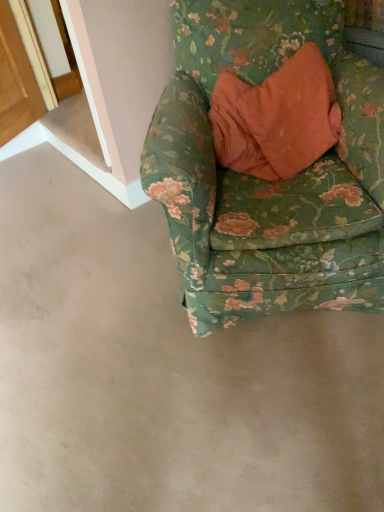
What do you see at coordinates (265, 181) in the screenshot?
I see `floral fabric chair at upper right` at bounding box center [265, 181].

The height and width of the screenshot is (512, 384). I want to click on floral fabric chair at upper right, so click(x=265, y=181).

This screenshot has width=384, height=512. Identify the location of gray concrete at lower center. (164, 372).

What do you see at coordinates (164, 372) in the screenshot?
I see `gray concrete at lower center` at bounding box center [164, 372].

Find the location of a particular element. floral fabric chair at upper right is located at coordinates (265, 181).

Which object is positioned more to the right, floral fabric chair at upper right or gray concrete at lower center?

floral fabric chair at upper right is more to the right.

Considering their positions, is floral fabric chair at upper right located in front of or behind gray concrete at lower center?

Clearly, floral fabric chair at upper right is behind gray concrete at lower center.

Considering the positions of point (157, 160) and point (165, 391), is point (157, 160) closer or farther from the camera than point (165, 391)?

Clearly, point (157, 160) is closer to the camera than point (165, 391).

From the image's perspective, who appears lower, floral fabric chair at upper right or gray concrete at lower center?

gray concrete at lower center appears lower in the image.

From a real-world perspective, is floral fabric chair at upper right located higher than gray concrete at lower center?

Yes, from a real-world perspective, floral fabric chair at upper right is above gray concrete at lower center.

Which of these two, floral fabric chair at upper right or gray concrete at lower center, is thinner?

floral fabric chair at upper right.

Between floral fabric chair at upper right and gray concrete at lower center, which one has less height?

gray concrete at lower center is shorter.

Between floral fabric chair at upper right and gray concrete at lower center, which one has larger size?

floral fabric chair at upper right.

Choose the correct answer: Is floral fabric chair at upper right inside gray concrete at lower center or outside it?

floral fabric chair at upper right is spatially situated outside gray concrete at lower center.

Is floral fabric chair at upper right with gray concrete at lower center?

No.

Is floral fabric chair at upper right aimed at gray concrete at lower center?

No, floral fabric chair at upper right is not oriented towards gray concrete at lower center.

How many degrees apart are the facing directions of floral fabric chair at upper right and gray concrete at lower center?

The facing directions of floral fabric chair at upper right and gray concrete at lower center are 126 degrees apart.

How much distance is there between floral fabric chair at upper right and gray concrete at lower center?

The distance of floral fabric chair at upper right from gray concrete at lower center is 18.42 inches.

You are a GUI agent. You are given a task and a screenshot of the screen. Output one action in this format:
    pyautogui.click(x=<x>, y=<y>)
    Task: Click on the chair located above the gray concrete at lower center (from a real-world perspective)
    
    Given the screenshot: What is the action you would take?
    pyautogui.click(x=265, y=181)

Is gray concrete at lower center at the right side of floral fabric chair at upper right?

No, gray concrete at lower center is not to the right of floral fabric chair at upper right.

In the image, is gray concrete at lower center positioned in front of or behind floral fabric chair at upper right?

In the image, gray concrete at lower center appears in front of floral fabric chair at upper right.

Which point is more distant from viewer, [165,456] or [268,270]?

The point [268,270] is farther from the camera.

From the image's perspective, is gray concrete at lower center above or below floral fabric chair at upper right?

Clearly, from the image's perspective, gray concrete at lower center is below floral fabric chair at upper right.

From a real-world perspective, does gray concrete at lower center stand above floral fabric chair at upper right?

No, from a real-world perspective, gray concrete at lower center is not above floral fabric chair at upper right.

Is gray concrete at lower center wider than floral fabric chair at upper right?

Yes, gray concrete at lower center is wider than floral fabric chair at upper right.

Considering the sizes of objects gray concrete at lower center and floral fabric chair at upper right in the image provided, who is taller, gray concrete at lower center or floral fabric chair at upper right?

With more height is floral fabric chair at upper right.

Can you confirm if gray concrete at lower center is bigger than floral fabric chair at upper right?

Incorrect, gray concrete at lower center is not larger than floral fabric chair at upper right.

Is gray concrete at lower center not inside floral fabric chair at upper right?

Yes, gray concrete at lower center is located beyond the bounds of floral fabric chair at upper right.

Is gray concrete at lower center beside floral fabric chair at upper right?

No, gray concrete at lower center is not touching floral fabric chair at upper right.

Is gray concrete at lower center positioned with its back to floral fabric chair at upper right?

gray concrete at lower center does not have its back to floral fabric chair at upper right.

This screenshot has height=512, width=384. Find the location of `concrete below the floral fabric chair at upper right (from the image's perspective)`. concrete below the floral fabric chair at upper right (from the image's perspective) is located at coordinates (164, 372).

Where is `chair above the gray concrete at lower center (from a real-world perspective)`? This screenshot has width=384, height=512. chair above the gray concrete at lower center (from a real-world perspective) is located at coordinates (265, 181).

This screenshot has height=512, width=384. I want to click on concrete below the floral fabric chair at upper right (from the image's perspective), so click(x=164, y=372).